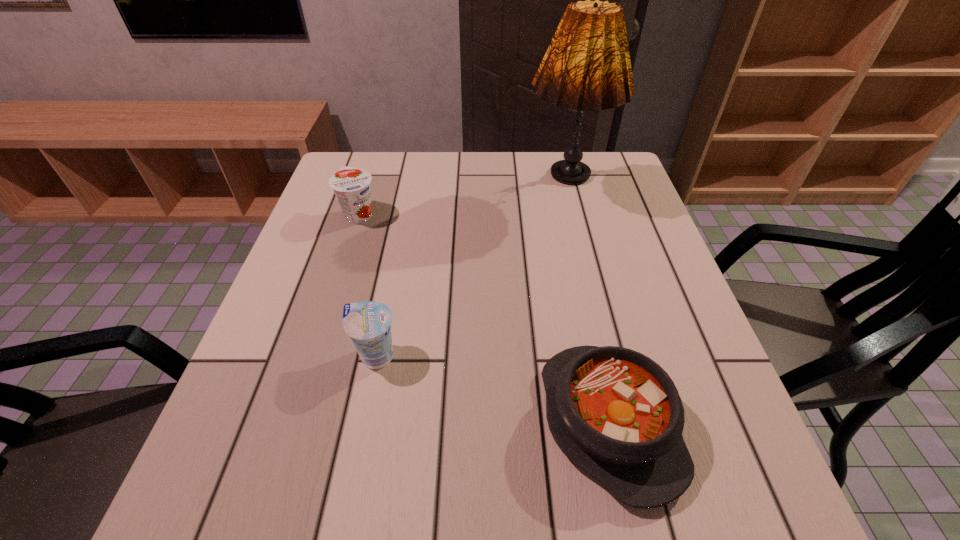
The height and width of the screenshot is (540, 960). In order to click on blank area at the far right corner in this screenshot , I will do `click(599, 189)`.

Where is `free point between the farther yogurt and the second object from left to right`? The height and width of the screenshot is (540, 960). free point between the farther yogurt and the second object from left to right is located at coordinates (368, 285).

Where is `vacant region between the farther yogurt and the casserole`? vacant region between the farther yogurt and the casserole is located at coordinates (484, 319).

At what (x,y) coordinates should I click in order to perform the action: click on vacant space that's between the casserole and the lampshade. Please return your answer as a coordinate pair (x, y). Image resolution: width=960 pixels, height=540 pixels. Looking at the image, I should click on (587, 306).

Where is `blank region between the tallest object and the casserole`? blank region between the tallest object and the casserole is located at coordinates (587, 306).

You are a GUI agent. You are given a task and a screenshot of the screen. Output one action in this format:
    pyautogui.click(x=<x>, y=<y>)
    Task: Click on the free spot between the lampshade and the left yogurt
    The image size is (960, 540).
    Given the screenshot: What is the action you would take?
    pyautogui.click(x=462, y=202)

Where is `empty space that is in between the tallest object and the farther yogurt`? This screenshot has width=960, height=540. empty space that is in between the tallest object and the farther yogurt is located at coordinates (462, 202).

Find the location of `vacant point located between the tallest object and the casserole`. vacant point located between the tallest object and the casserole is located at coordinates (587, 306).

Locate an element on the screen. The width and height of the screenshot is (960, 540). free spot between the nearer yogurt and the tallest object is located at coordinates (470, 273).

At what (x,y) coordinates should I click in order to perform the action: click on empty space that is in between the left yogurt and the second object from left to right. Please return your answer as a coordinate pair (x, y). The height and width of the screenshot is (540, 960). Looking at the image, I should click on (368, 285).